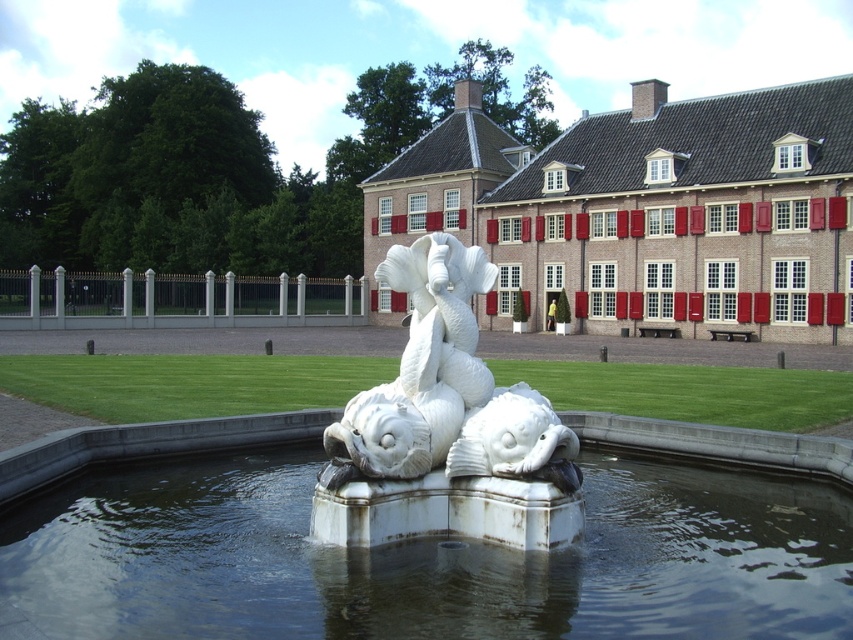
You are designing a new fountain and want to ensure the water area is proportionate to the sculpture. Given the clear water at fountain center and the white marble fish at center, which one is larger in size?

The white marble fish at center is larger in size compared to the clear water at fountain center.

Consider the image. You are standing in front of the fountain and want to place a small flowerpot between the white marble sculpture at center and the white marble fish at center. According to the scene description, which object should the flowerpot be closer to?

The white marble sculpture at center is positioned on the left side of white marble fish at center, so the flowerpot should be placed between them with the sculpture on the left and the fish on the right.

You are standing in front of the fountain and want to take a photo of both the brick red building at center and the white marble fish at center. Which direction should you turn to ensure both are in the frame?

You should turn to the left because the brick red building at center is to the right of the white marble fish at center, so turning left will position both in your field of view.